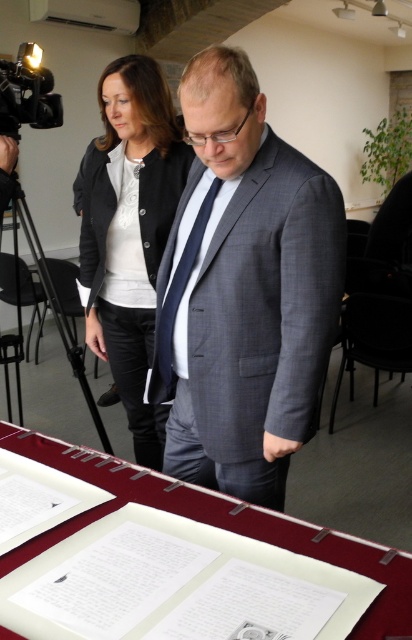
Question: Does gray textured suit at center have a smaller size compared to matte black blazer at center?

Choices:
 (A) no
 (B) yes

Answer: (B)

Question: Is gray textured suit at center below matte black blazer at center?

Choices:
 (A) yes
 (B) no

Answer: (A)

Question: Which point is closer to the camera?

Choices:
 (A) white paper at center
 (B) matte black blazer at center
 (C) dark blue textured tie at center

Answer: (A)

Question: Which point is closer to the camera?

Choices:
 (A) gray textured suit at center
 (B) matte black blazer at center

Answer: (A)

Question: Among these points, which one is farthest from the camera?

Choices:
 (A) (138, 96)
 (B) (14, 560)
 (C) (173, 376)

Answer: (A)

Question: Is gray textured suit at center below dark blue textured tie at center?

Choices:
 (A) yes
 (B) no

Answer: (B)